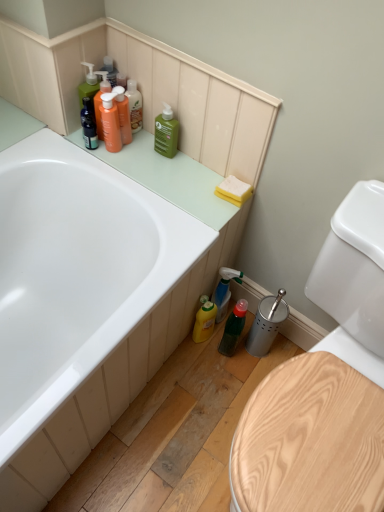
Identify the location of vacant area situated to the left side of translucent orange bottle at upper left, which ranks as the first cleaning product in left-to-right order. (59, 142).